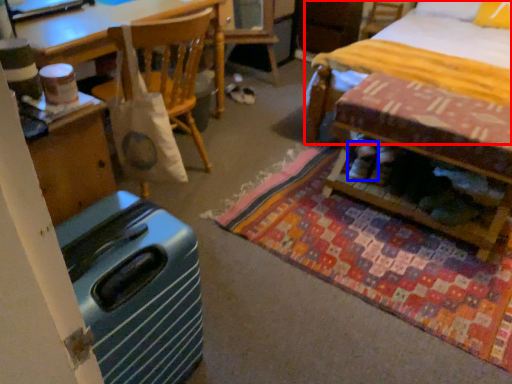
Question: Which of the following is the farthest to the observer, bed (highlighted by a red box) or footwear (highlighted by a blue box)?

Choices:
 (A) bed
 (B) footwear

Answer: (B)